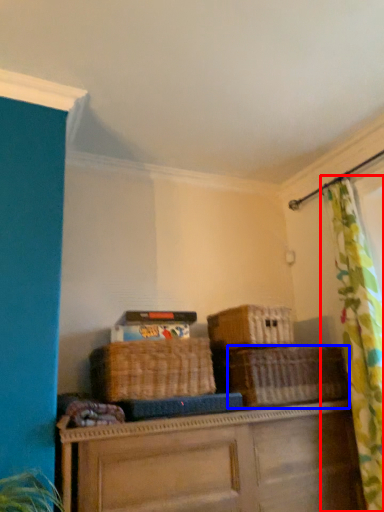
Question: Which object is closer to the camera taking this photo, curtain (highlighted by a red box) or basket (highlighted by a blue box)?

Choices:
 (A) curtain
 (B) basket

Answer: (A)